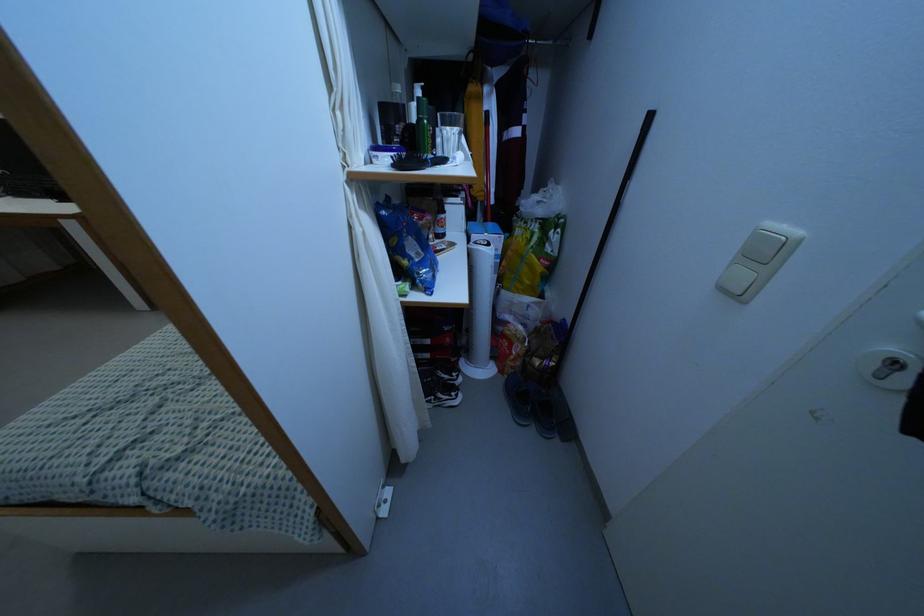
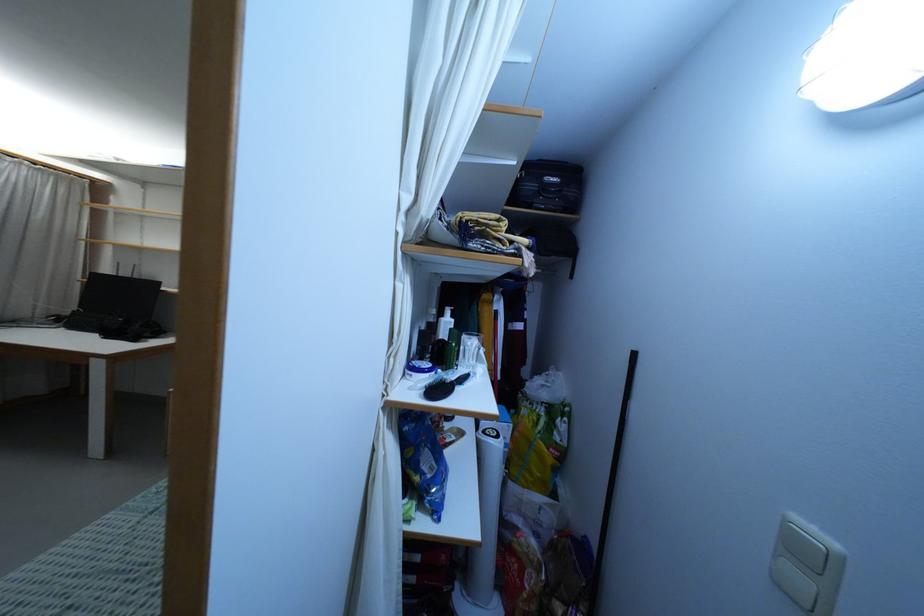
Question: Based on the continuous images, in which direction is the camera rotating? Reply with the corresponding letter.

Choices:
 (A) Left
 (B) Right
 (C) Up
 (D) Down

Answer: (C)